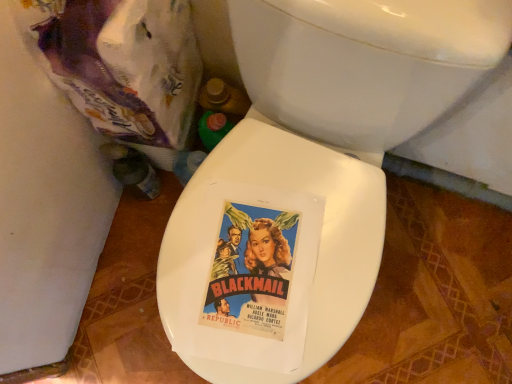
The image size is (512, 384). What do you see at coordinates (121, 66) in the screenshot?
I see `purple plastic bag at upper left` at bounding box center [121, 66].

I want to click on purple plastic bag at upper left, so click(121, 66).

What is the approximate width of purple plastic bag at upper left?

purple plastic bag at upper left is 9.41 inches in width.

Where is `white glossy toilet seat at center`? This screenshot has width=512, height=384. white glossy toilet seat at center is located at coordinates (344, 126).

In order to face white glossy toilet seat at center, should I rotate leftwards or rightwards?

To face it directly, rotate right by 4.125 degrees.

The height and width of the screenshot is (384, 512). What do you see at coordinates (344, 126) in the screenshot?
I see `white glossy toilet seat at center` at bounding box center [344, 126].

At what (x,y) coordinates should I click in order to perform the action: click on purple plastic bag at upper left. Please return your answer as a coordinate pair (x, y). The width and height of the screenshot is (512, 384). Looking at the image, I should click on (121, 66).

In the scene shown: Is purple plastic bag at upper left at the right side of white glossy toilet seat at center?

Incorrect, purple plastic bag at upper left is not on the right side of white glossy toilet seat at center.

Is purple plastic bag at upper left closer to camera compared to white glossy toilet seat at center?

No, the depth of purple plastic bag at upper left is greater than that of white glossy toilet seat at center.

Which is farther, (66, 34) or (362, 134)?

Positioned behind is point (362, 134).

From the image's perspective, is purple plastic bag at upper left over white glossy toilet seat at center?

Correct, purple plastic bag at upper left appears higher than white glossy toilet seat at center in the image.

From a real-world perspective, is purple plastic bag at upper left under white glossy toilet seat at center?

No, from a real-world perspective, purple plastic bag at upper left is not under white glossy toilet seat at center.

Considering the relative sizes of purple plastic bag at upper left and white glossy toilet seat at center in the image provided, is purple plastic bag at upper left wider than white glossy toilet seat at center?

No, purple plastic bag at upper left is not wider than white glossy toilet seat at center.

Considering the sizes of objects purple plastic bag at upper left and white glossy toilet seat at center in the image provided, who is shorter, purple plastic bag at upper left or white glossy toilet seat at center?

purple plastic bag at upper left.

Considering the relative sizes of purple plastic bag at upper left and white glossy toilet seat at center in the image provided, is purple plastic bag at upper left smaller than white glossy toilet seat at center?

Yes, purple plastic bag at upper left is smaller than white glossy toilet seat at center.

From the picture: Would you say purple plastic bag at upper left is outside white glossy toilet seat at center?

Yes, purple plastic bag at upper left is outside of white glossy toilet seat at center.

Is purple plastic bag at upper left with white glossy toilet seat at center?

No, purple plastic bag at upper left is not with white glossy toilet seat at center.

Could you tell me if purple plastic bag at upper left is facing white glossy toilet seat at center?

No, purple plastic bag at upper left is not oriented towards white glossy toilet seat at center.

How many degrees apart are the facing directions of purple plastic bag at upper left and white glossy toilet seat at center?

The angular difference between purple plastic bag at upper left and white glossy toilet seat at center is 7.08 degrees.

How far apart are purple plastic bag at upper left and white glossy toilet seat at center?

purple plastic bag at upper left and white glossy toilet seat at center are 10.27 inches apart.

This screenshot has width=512, height=384. Find the location of `garbage above the white glossy toilet seat at center (from a real-world perspective)`. garbage above the white glossy toilet seat at center (from a real-world perspective) is located at coordinates (121, 66).

Is white glossy toilet seat at center to the left or to the right of purple plastic bag at upper left in the image?

From the image, it's evident that white glossy toilet seat at center is to the right of purple plastic bag at upper left.

Is the depth of white glossy toilet seat at center greater than that of purple plastic bag at upper left?

No, white glossy toilet seat at center is closer to the camera.

Is point (303, 118) farther from camera compared to point (122, 98)?

Yes.

From the image's perspective, who appears lower, white glossy toilet seat at center or purple plastic bag at upper left?

white glossy toilet seat at center is shown below in the image.

From a real-world perspective, which is physically above, white glossy toilet seat at center or purple plastic bag at upper left?

In real-world perspective, purple plastic bag at upper left is above.

Between white glossy toilet seat at center and purple plastic bag at upper left, which one has smaller width?

With smaller width is purple plastic bag at upper left.

Which of these two, white glossy toilet seat at center or purple plastic bag at upper left, stands taller?

With more height is white glossy toilet seat at center.

Does white glossy toilet seat at center have a larger size compared to purple plastic bag at upper left?

Indeed, white glossy toilet seat at center has a larger size compared to purple plastic bag at upper left.

Based on the photo, would you say white glossy toilet seat at center contains purple plastic bag at upper left?

Definitely not — purple plastic bag at upper left is not inside white glossy toilet seat at center.

Would you consider white glossy toilet seat at center to be distant from purple plastic bag at upper left?

No, white glossy toilet seat at center is not far away from purple plastic bag at upper left.

Does white glossy toilet seat at center turn towards purple plastic bag at upper left?

No, white glossy toilet seat at center is not facing towards purple plastic bag at upper left.

How different are the orientations of white glossy toilet seat at center and purple plastic bag at upper left in degrees?

The angle between the facing direction of white glossy toilet seat at center and the facing direction of purple plastic bag at upper left is 7.08 degrees.

You are a GUI agent. You are given a task and a screenshot of the screen. Output one action in this format:
    pyautogui.click(x=<x>, y=<y>)
    Task: Click on the toilet on the right side of purple plastic bag at upper left
    
    Given the screenshot: What is the action you would take?
    pyautogui.click(x=344, y=126)

Image resolution: width=512 pixels, height=384 pixels. Identify the location of toilet in front of the purple plastic bag at upper left. (344, 126).

The image size is (512, 384). In order to click on garbage that appears above the white glossy toilet seat at center (from the image's perspective) in this screenshot , I will do `click(121, 66)`.